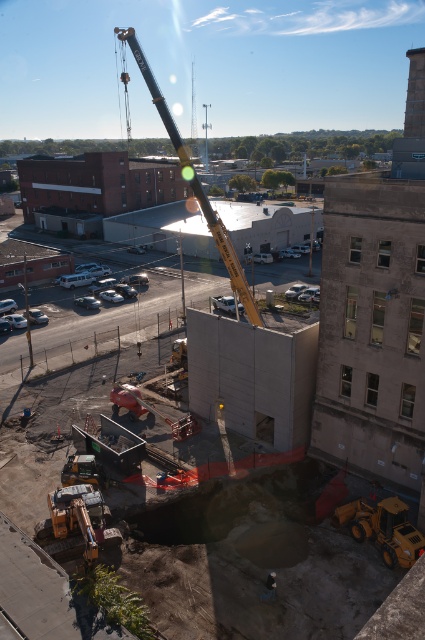
Question: Which point is farther to the camera?

Choices:
 (A) (380, 552)
 (B) (268, 588)
 (C) (164, 420)
 (D) (159, 93)

Answer: (C)

Question: Which point appears farthest from the camera in this image?

Choices:
 (A) (402, 554)
 (B) (272, 580)

Answer: (A)

Question: Which is nearer to the orange rubber crane at center?

Choices:
 (A) orange metallic excavator at lower left
 (B) blue fabric construction worker at lower center
 (C) yellow metallic crane at upper center
 (D) yellow rubber tractor at lower right

Answer: (A)

Question: Is yellow metallic crane at upper center positioned in front of blue fabric construction worker at lower center?

Choices:
 (A) no
 (B) yes

Answer: (A)

Question: Can you confirm if yellow metallic crane at upper center is thinner than yellow rubber tractor at lower right?

Choices:
 (A) no
 (B) yes

Answer: (A)

Question: From the image, what is the correct spatial relationship of orange rubber crane at center in relation to blue fabric construction worker at lower center?

Choices:
 (A) below
 (B) above

Answer: (B)